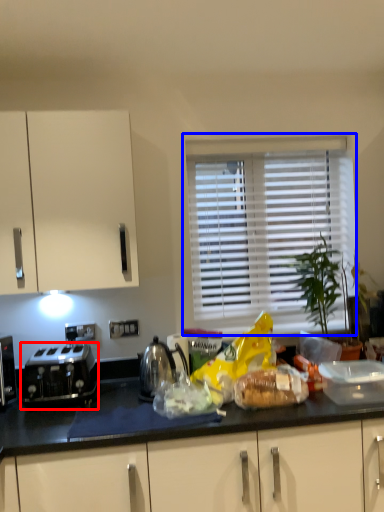
Question: Which of the following is the closest to the observer, toaster (highlighted by a red box) or window (highlighted by a blue box)?

Choices:
 (A) toaster
 (B) window

Answer: (A)